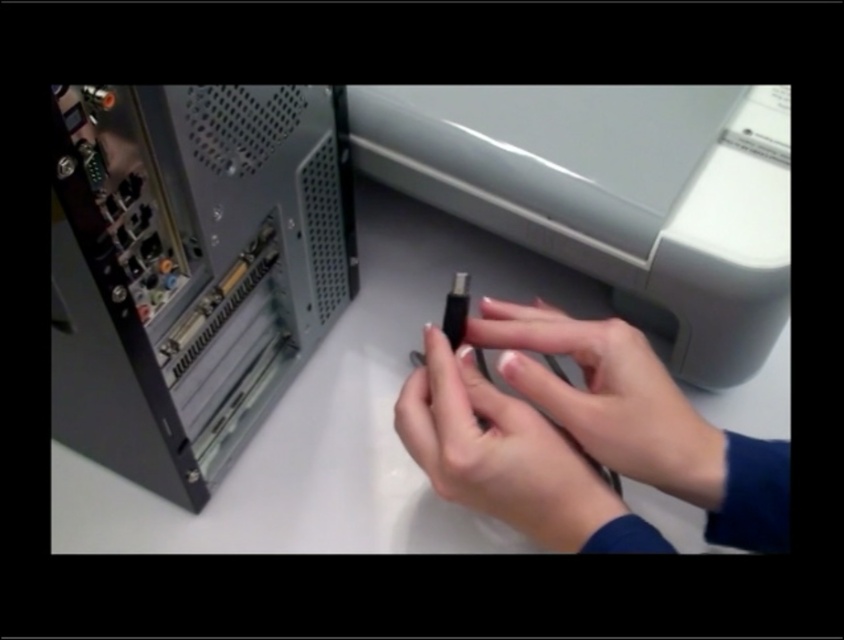
You are trying to plug in a USB cable into the computer tower. Based on the scene, which object is positioned to the left of the other, the black plastic computer at center or the smooth skin hands at center?

The black plastic computer at center is to the left of smooth skin hands at center according to the description.

You are trying to decide which item to place in a small storage compartment. You have the matte gray printer at center and the smooth matte black usb drive at center. Which one is more likely to fit?

The smooth matte black usb drive at center is smaller, so it is more likely to fit in the small storage compartment than the matte gray printer at center.

You are trying to connect a USB drive to a computer tower. You see the matte gray printer at center and the smooth matte black usb drive at center. Which object is positioned higher in the image?

The matte gray printer at center is above the smooth matte black usb drive at center, so the matte gray printer at center is positioned higher in the image.